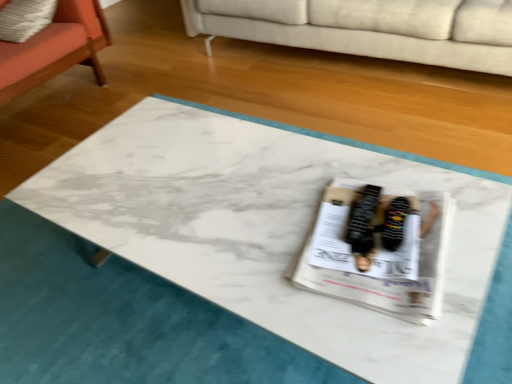
Locate an element on the screen. unoccupied space behind black suede sneakers at center is located at coordinates (362, 184).